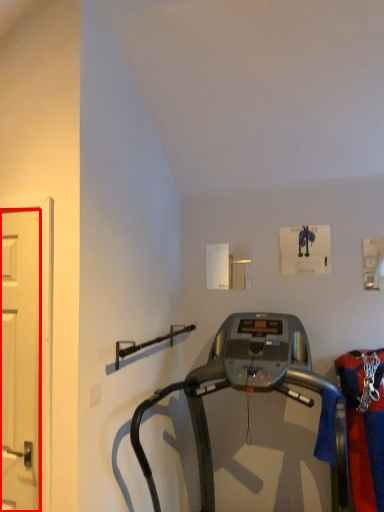
Question: From the image's perspective, what is the correct spatial positioning of door (annotated by the red box) in reference to treadmill?

Choices:
 (A) below
 (B) above

Answer: (B)